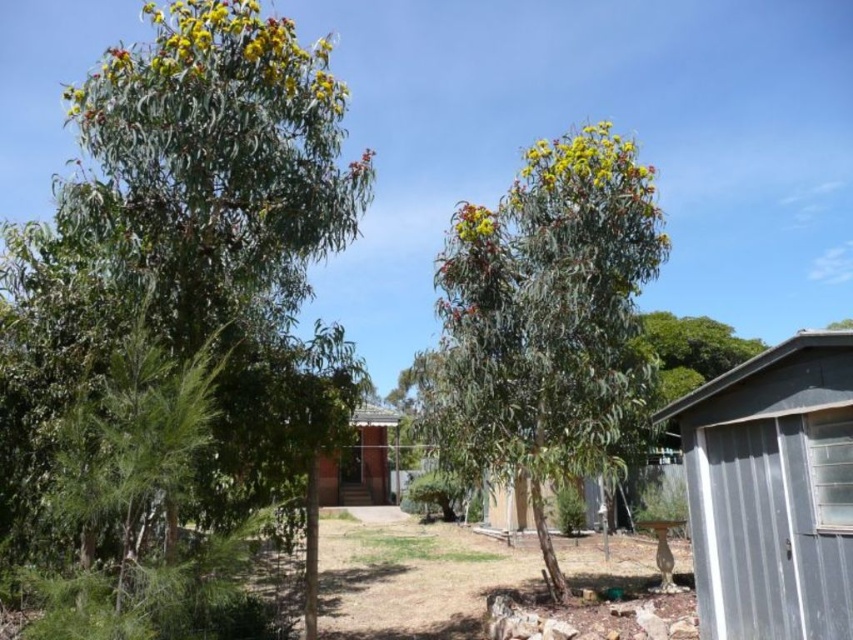
Question: Among these points, which one is nearest to the camera?

Choices:
 (A) (767, 604)
 (B) (381, 497)
 (C) (12, 397)

Answer: (C)

Question: Is green glossy tree at center wider than brown wood hut at center?

Choices:
 (A) yes
 (B) no

Answer: (B)

Question: Is metallic gray shed at lower right smaller than brown wood hut at center?

Choices:
 (A) no
 (B) yes

Answer: (B)

Question: Based on their relative distances, which object is farther from the metallic gray shed at lower right?

Choices:
 (A) green glossy tree at center
 (B) green leafy tree at center
 (C) brown wood hut at center

Answer: (C)

Question: Can you confirm if green glossy tree at center is thinner than green leafy tree at center?

Choices:
 (A) yes
 (B) no

Answer: (B)

Question: Which point appears closest to the camera in this image?

Choices:
 (A) (212, 323)
 (B) (550, 385)
 (C) (366, 499)

Answer: (A)